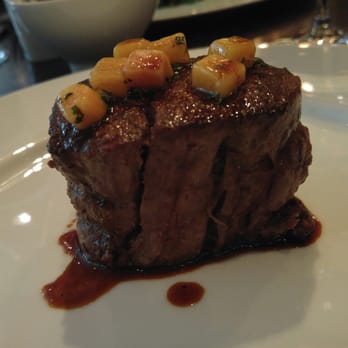
Identify the location of bowl. (102, 19).